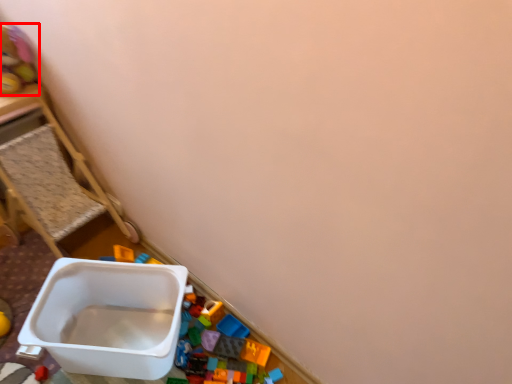
Question: From the image's perspective, where is toy (annotated by the red box) located relative to furniture?

Choices:
 (A) below
 (B) above

Answer: (B)